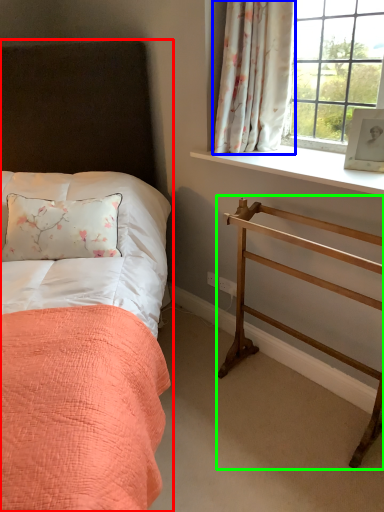
Question: Considering the real-world distances, which object is closest to bed (highlighted by a red box)? curtain (highlighted by a blue box) or balustrade (highlighted by a green box).

Choices:
 (A) curtain
 (B) balustrade

Answer: (A)